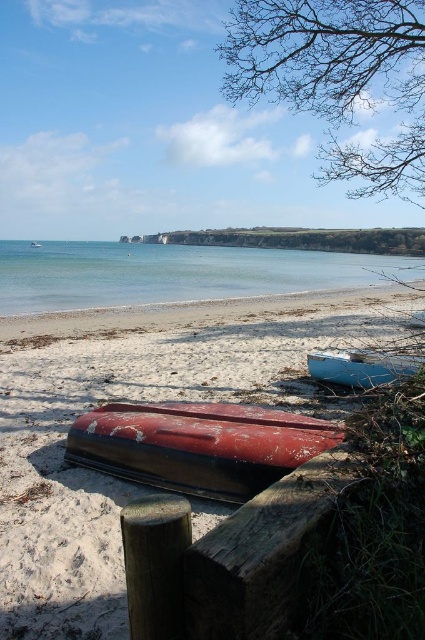
Question: Which point is closer to the camera?

Choices:
 (A) (300, 436)
 (B) (328, 10)
 (C) (235, 259)

Answer: (A)

Question: Is smooth sand at lower center above light blue wooden boat at center?

Choices:
 (A) yes
 (B) no

Answer: (A)

Question: Which of the following is the closest to the observer?

Choices:
 (A) light blue wooden boat at center
 (B) rusty wood canoe at lower left

Answer: (B)

Question: Where is clear blue water at center located in relation to rusty wood canoe at lower left in the image?

Choices:
 (A) left
 (B) right

Answer: (A)

Question: Based on their relative distances, which object is farther from the rusty wood canoe at lower left?

Choices:
 (A) smooth sand at lower center
 (B) light blue wooden boat at center
 (C) bare branches at upper right
 (D) clear blue water at center

Answer: (D)

Question: Does smooth sand at lower center come in front of bare branches at upper right?

Choices:
 (A) yes
 (B) no

Answer: (A)